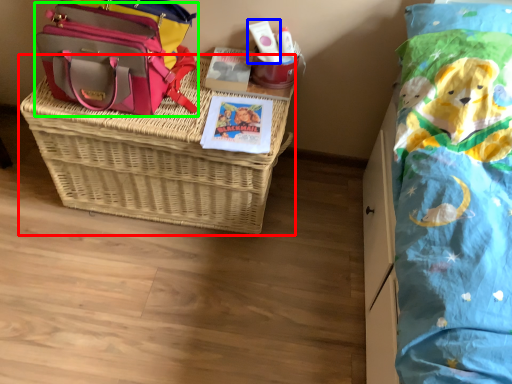
Question: Which object is positioned farthest from picnic basket (highlighted by a red box)? Select from toiletry (highlighted by a blue box) and shoulder bag (highlighted by a green box).

Choices:
 (A) toiletry
 (B) shoulder bag

Answer: (A)